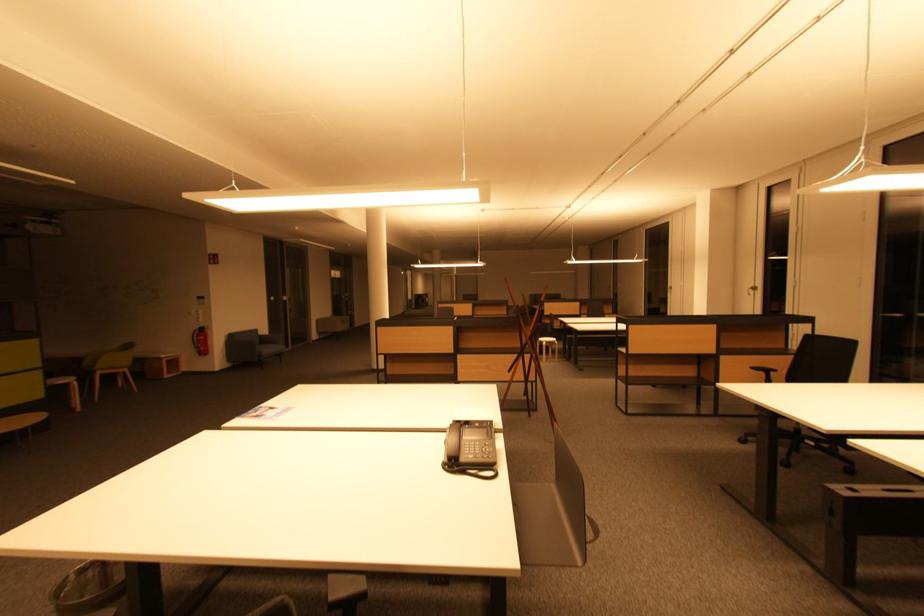
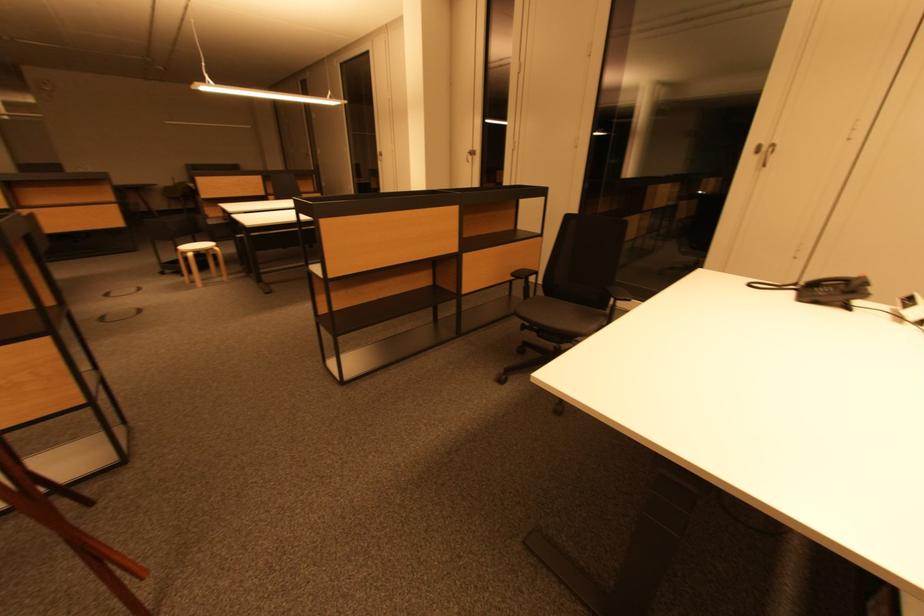
Locate, in the second image, the point that corresponds to pixel 549 345 in the first image.

(193, 256)